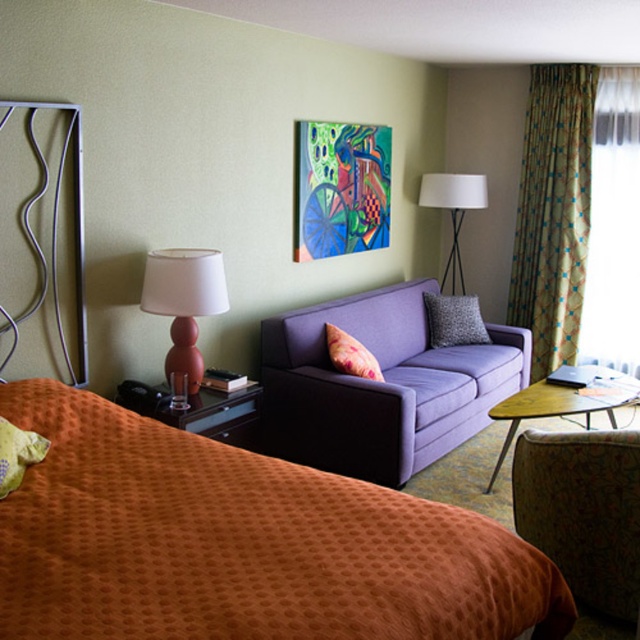
Can you confirm if floral fabric armchair at lower right is positioned to the left of green textured pillow at lower left?

Incorrect, floral fabric armchair at lower right is not on the left side of green textured pillow at lower left.

Is point (545, 506) in front of point (16, 465)?

No, (545, 506) is further to viewer.

Identify the location of floral fabric armchair at lower right. (582, 513).

At what (x,y) coordinates should I click in order to perform the action: click on floral fabric armchair at lower right. Please return your answer as a coordinate pair (x, y). Looking at the image, I should click on (582, 513).

Which is more to the right, matte pink lamp at left or green textured pillow at lower left?

Positioned to the right is matte pink lamp at left.

Is point (170, 301) closer to camera compared to point (3, 458)?

No, (170, 301) is further to viewer.

The image size is (640, 640). Describe the element at coordinates (184, 301) in the screenshot. I see `matte pink lamp at left` at that location.

Where is `matte pink lamp at left`? matte pink lamp at left is located at coordinates (184, 301).

What do you see at coordinates (380, 385) in the screenshot?
I see `purple fabric couch at center` at bounding box center [380, 385].

Between purple fabric couch at center and woodenwoodentable at right, which one appears on the left side from the viewer's perspective?

Positioned to the left is purple fabric couch at center.

Find the location of a particular element. The height and width of the screenshot is (640, 640). purple fabric couch at center is located at coordinates (380, 385).